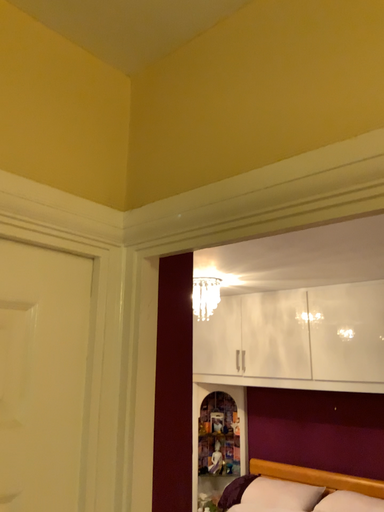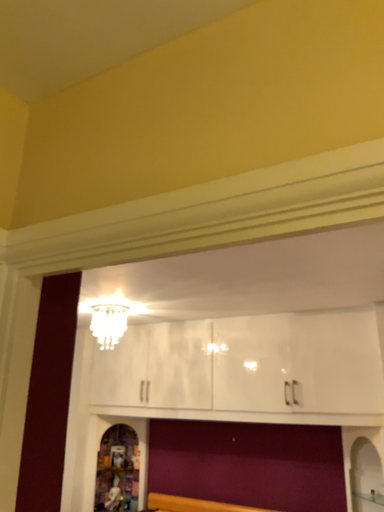
Question: Which way did the camera rotate in the video?

Choices:
 (A) rotated right
 (B) rotated left

Answer: (A)